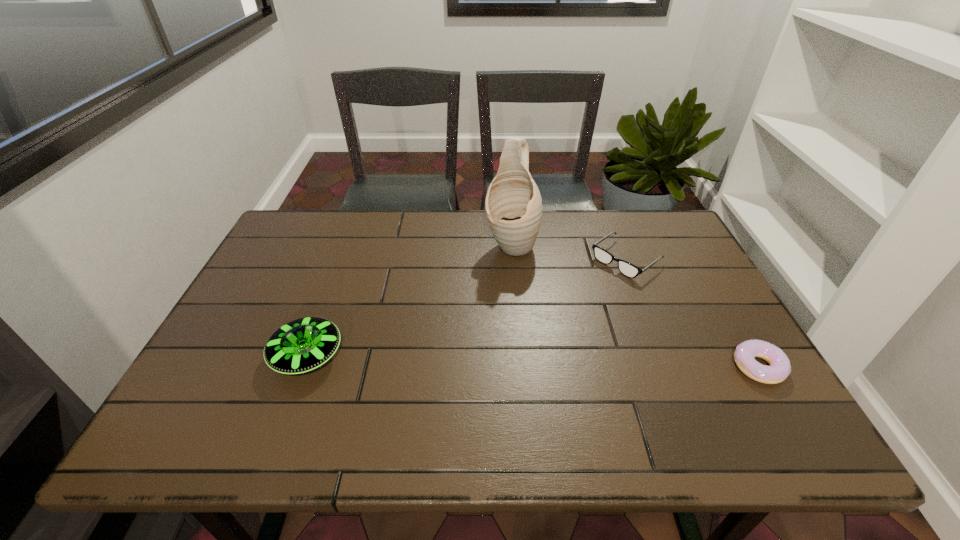
The width and height of the screenshot is (960, 540). In order to click on spectacles that is at the right edge in this screenshot , I will do (x=629, y=270).

I want to click on object present at the near left corner, so click(302, 345).

Where is `object present at the far right corner`? object present at the far right corner is located at coordinates (629, 270).

Find the location of a particular element. The height and width of the screenshot is (540, 960). object positioned at the near right corner is located at coordinates (745, 353).

What are the coordinates of `vacant space at the far edge of the desktop` in the screenshot? It's located at (356, 235).

Identify the location of blank space at the near edge. The width and height of the screenshot is (960, 540). (526, 383).

The image size is (960, 540). What are the coordinates of `free space at the left edge of the desktop` in the screenshot? It's located at (247, 343).

Find the location of `vacant space at the far left corner`. vacant space at the far left corner is located at coordinates (299, 215).

In the image, there is a desktop. Where is `free space at the near left corner`? The image size is (960, 540). free space at the near left corner is located at coordinates [243, 401].

This screenshot has height=540, width=960. Find the location of `vacant space at the near right corner of the desktop`. vacant space at the near right corner of the desktop is located at coordinates (731, 389).